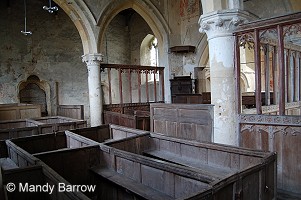
Locate an element on the screen. This screenshot has height=200, width=301. pillars is located at coordinates (220, 36), (92, 88).